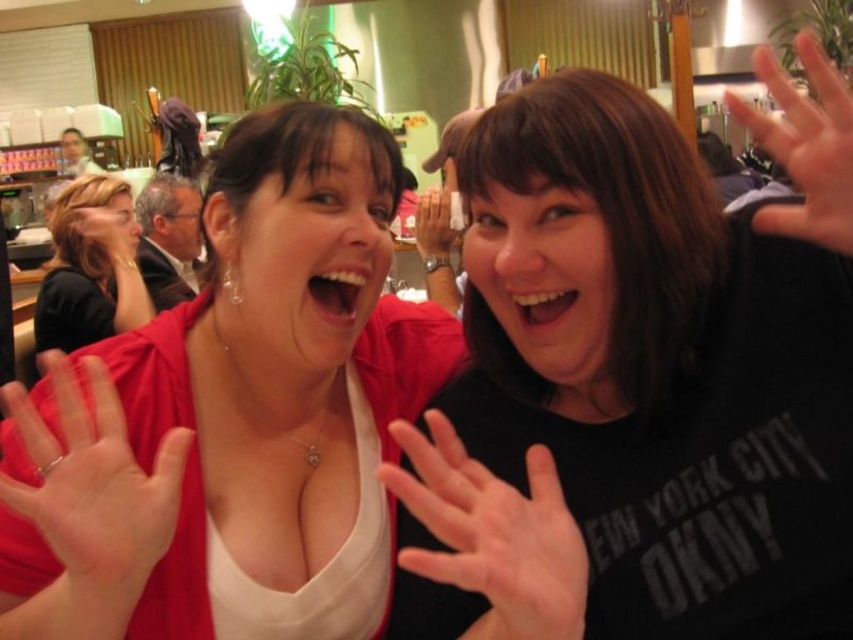
Is black matte shirt at center in front of pale skin flesh at center?

Yes, it is in front of pale skin flesh at center.

Image resolution: width=853 pixels, height=640 pixels. I want to click on black matte shirt at center, so click(x=639, y=381).

Who is higher up, pale skin flesh at center or matte black hand at upper right?

matte black hand at upper right

Is pale skin flesh at center bigger than matte black hand at upper right?

No, pale skin flesh at center is not bigger than matte black hand at upper right.

The width and height of the screenshot is (853, 640). Find the location of `pale skin flesh at center`. pale skin flesh at center is located at coordinates (90, 488).

Is pale skin flesh at center above white matte hand at center?

Yes, pale skin flesh at center is above white matte hand at center.

Does pale skin flesh at center come behind white matte hand at center?

That is True.

At what (x,y) coordinates should I click in order to perform the action: click on pale skin flesh at center. Please return your answer as a coordinate pair (x, y). Image resolution: width=853 pixels, height=640 pixels. Looking at the image, I should click on (90, 488).